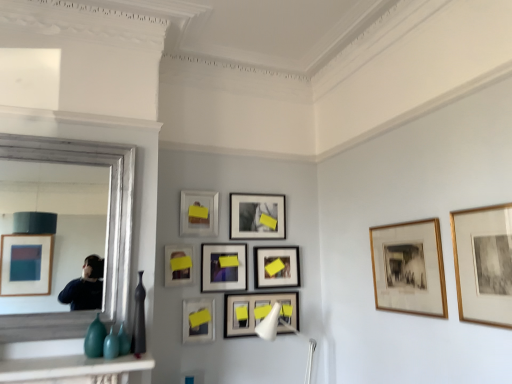
At what (x,y) coordinates should I click in order to perform the action: click on free space to the left of teal glass vase at lower left. Please return your answer as a coordinate pair (x, y). The height and width of the screenshot is (384, 512). Looking at the image, I should click on (66, 353).